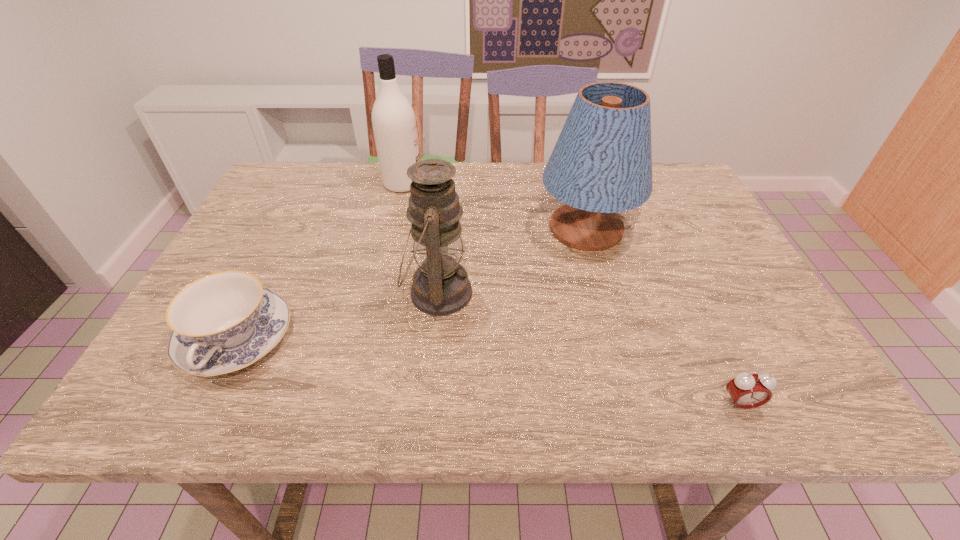
I want to click on shampoo, so click(394, 125).

Identify the location of the fourth object from left to right. (602, 162).

Locate an element on the screen. The width and height of the screenshot is (960, 540). oil lamp is located at coordinates (441, 287).

Where is `chinaware`? chinaware is located at coordinates (223, 322).

Find the location of a particular element. the rightmost object is located at coordinates (747, 391).

This screenshot has width=960, height=540. In order to click on alarm clock in this screenshot , I will do `click(747, 391)`.

Identify the location of vacant space located on the front-facing side of the shampoo. (446, 184).

This screenshot has width=960, height=540. I want to click on free region located on the front of the lampshade, so click(x=614, y=328).

The height and width of the screenshot is (540, 960). I want to click on vacant space situated 0.170m on the front of the oil lamp, so click(x=427, y=406).

This screenshot has width=960, height=540. Identify the location of shampoo located at the far edge. (394, 125).